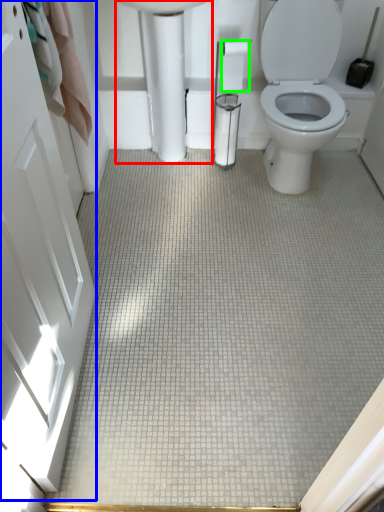
Question: Which object is the farthest from porcelain (highlighted by a red box)? Choose among these: screen door (highlighted by a blue box) or toilet paper (highlighted by a green box).

Choices:
 (A) screen door
 (B) toilet paper

Answer: (A)